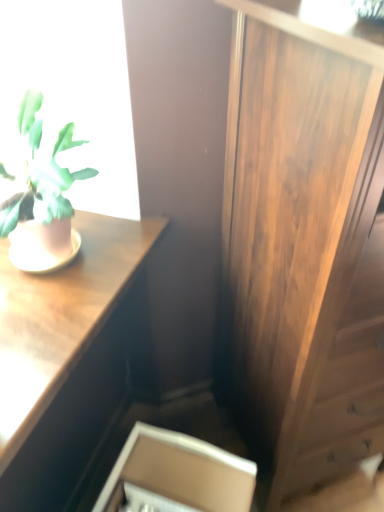
Question: Is wooden desk at upper left with pink matte flowerpot at left?

Choices:
 (A) yes
 (B) no

Answer: (B)

Question: Is wooden desk at upper left not within pink matte flowerpot at left?

Choices:
 (A) no
 (B) yes

Answer: (B)

Question: Is wooden desk at upper left thinner than pink matte flowerpot at left?

Choices:
 (A) yes
 (B) no

Answer: (B)

Question: Does wooden desk at upper left have a larger size compared to pink matte flowerpot at left?

Choices:
 (A) yes
 (B) no

Answer: (A)

Question: Is wooden desk at upper left taller than pink matte flowerpot at left?

Choices:
 (A) no
 (B) yes

Answer: (B)

Question: Could pink matte flowerpot at left be considered to be inside wooden desk at upper left?

Choices:
 (A) yes
 (B) no

Answer: (B)

Question: From a real-world perspective, is wooden side cabinet at right physically above matte pink pot at left?

Choices:
 (A) no
 (B) yes

Answer: (A)

Question: Does wooden side cabinet at right have a greater height compared to matte pink pot at left?

Choices:
 (A) yes
 (B) no

Answer: (A)

Question: Would you say matte pink pot at left is part of wooden side cabinet at right's contents?

Choices:
 (A) no
 (B) yes

Answer: (A)

Question: Is wooden side cabinet at right outside of matte pink pot at left?

Choices:
 (A) no
 (B) yes

Answer: (B)

Question: Does wooden side cabinet at right have a smaller size compared to matte pink pot at left?

Choices:
 (A) no
 (B) yes

Answer: (A)

Question: Is wooden side cabinet at right looking in the opposite direction of matte pink pot at left?

Choices:
 (A) yes
 (B) no

Answer: (B)

Question: Is matte pink pot at left closer to camera compared to wooden side cabinet at right?

Choices:
 (A) no
 (B) yes

Answer: (A)